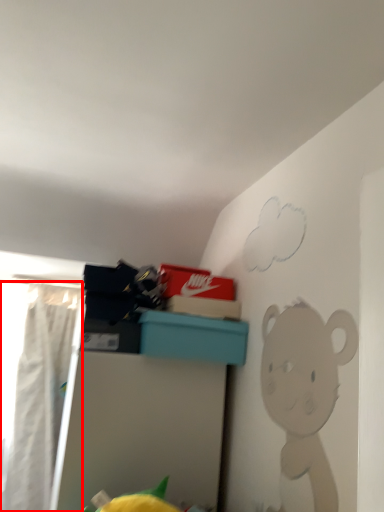
Question: In this image, where is curtain (annotated by the red box) located relative to furniture?

Choices:
 (A) left
 (B) right

Answer: (A)